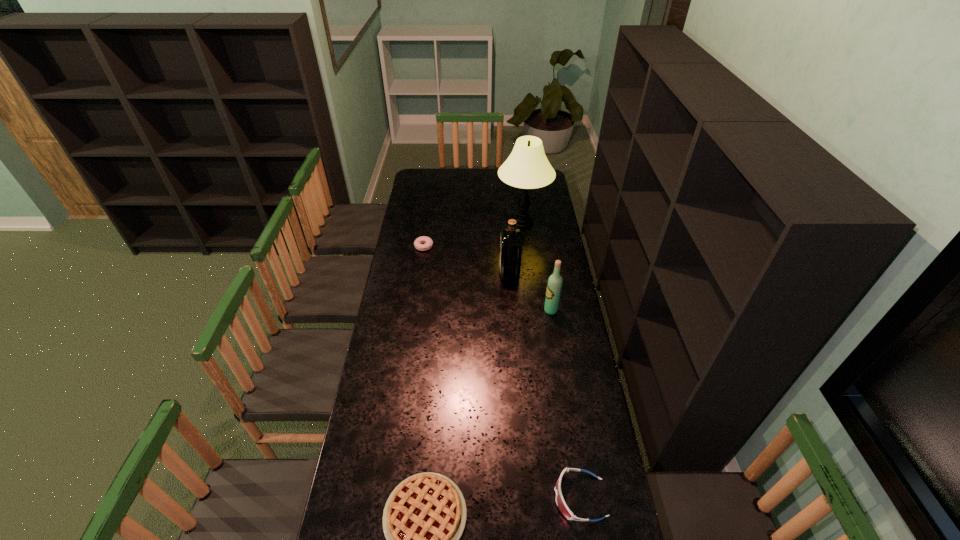
This screenshot has height=540, width=960. I want to click on the fifth closest object to the fourth nearest object, so click(424, 517).

Image resolution: width=960 pixels, height=540 pixels. In order to click on object that is the third closest to the liquor in this screenshot , I will do `click(428, 241)`.